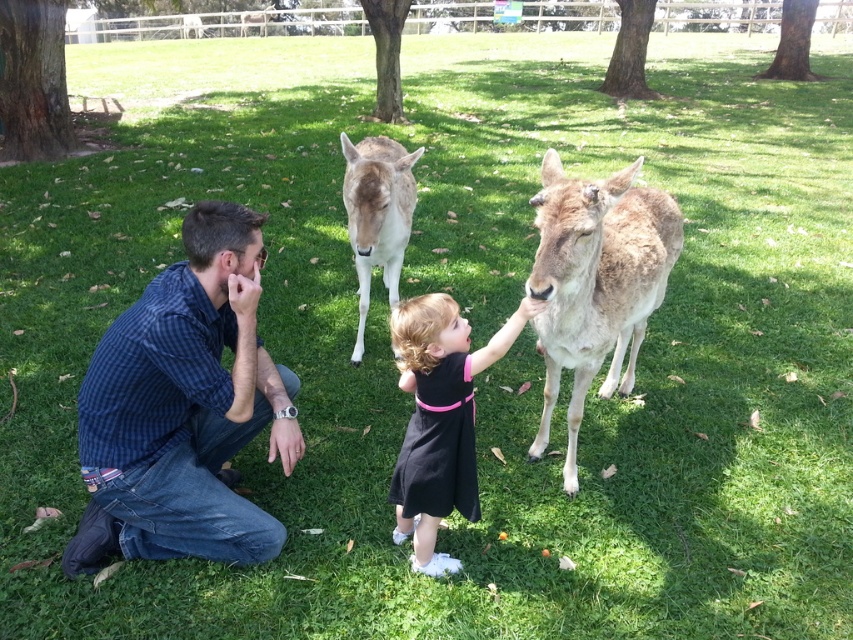
Is point (561, 170) positioned before point (368, 264)?

No, (561, 170) is behind (368, 264).

Does brown fur deer at center appear over light brown fur at center?

No, brown fur deer at center is not above light brown fur at center.

Is point (675, 221) more distant than point (341, 198)?

No, it is not.

The width and height of the screenshot is (853, 640). I want to click on brown fur deer at center, so click(595, 284).

In the scene shown: Does brown fur deer at center have a lesser width compared to black matte dress at center?

No.

Between brown fur deer at center and black matte dress at center, which one is positioned higher?

brown fur deer at center

Does point (563, 225) come behind point (401, 387)?

No, it is in front of (401, 387).

You are a GUI agent. You are given a task and a screenshot of the screen. Output one action in this format:
    pyautogui.click(x=<x>, y=<y>)
    Task: Click on the brown fur deer at center
    The height and width of the screenshot is (640, 853).
    Given the screenshot: What is the action you would take?
    pyautogui.click(x=595, y=284)

Between black matte dress at center and light brown fur at center, which one is positioned higher?

light brown fur at center is above.

Does black matte dress at center come behind light brown fur at center?

No, black matte dress at center is closer to the viewer.

Who is more forward, (521, 310) or (358, 285)?

Point (521, 310) is in front.

Where is `black matte dress at center`? This screenshot has height=640, width=853. black matte dress at center is located at coordinates (440, 419).